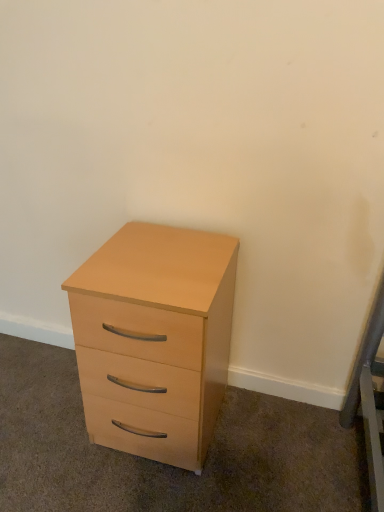
Where is `vacant region above light wood/veneer chest of drawers at lower left (from a real-world perspective)`? The height and width of the screenshot is (512, 384). vacant region above light wood/veneer chest of drawers at lower left (from a real-world perspective) is located at coordinates (165, 247).